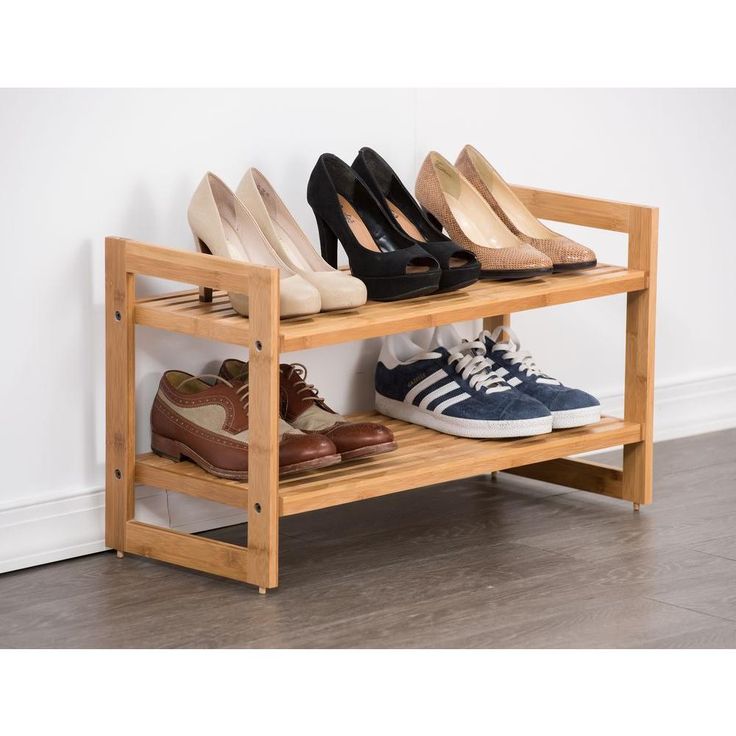
Identify the location of pairs of shoes. (266, 227), (386, 213), (492, 205), (498, 367), (291, 411).